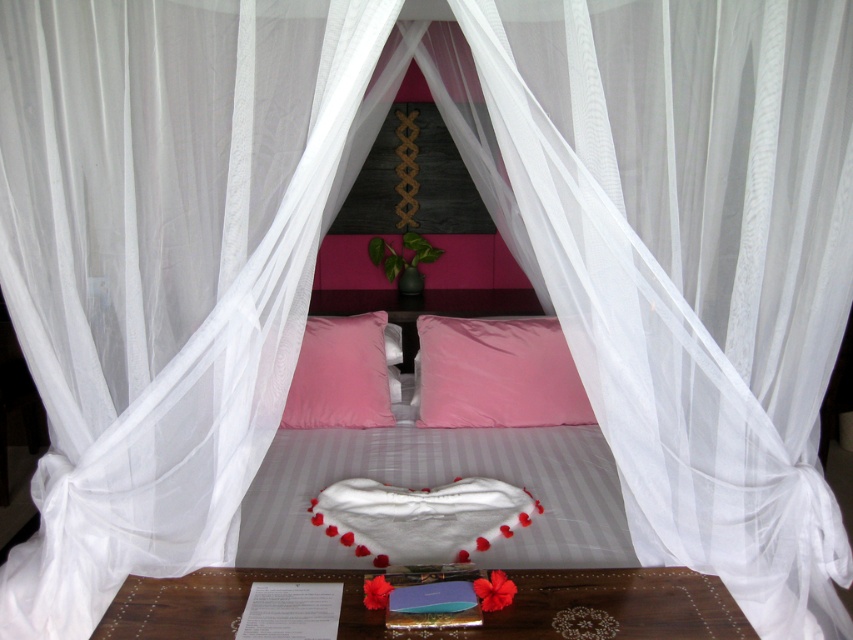
Question: Which point appears closest to the camera in this image?

Choices:
 (A) (300, 360)
 (B) (525, 561)
 (C) (395, 552)

Answer: (B)

Question: Does pink velvet pillows at center have a greater width compared to wooden tray at lower center?

Choices:
 (A) yes
 (B) no

Answer: (B)

Question: Which of the following is the farthest from the observer?

Choices:
 (A) (497, 340)
 (B) (589, 577)

Answer: (A)

Question: Which point is closer to the camera taking this photo?

Choices:
 (A) (456, 356)
 (B) (404, 412)

Answer: (A)

Question: Does wooden tray at lower center have a greater width compared to pink matte pillow at center?

Choices:
 (A) no
 (B) yes

Answer: (B)

Question: Is pink matte pillow at center positioned behind matte pink pillow at center?

Choices:
 (A) no
 (B) yes

Answer: (B)